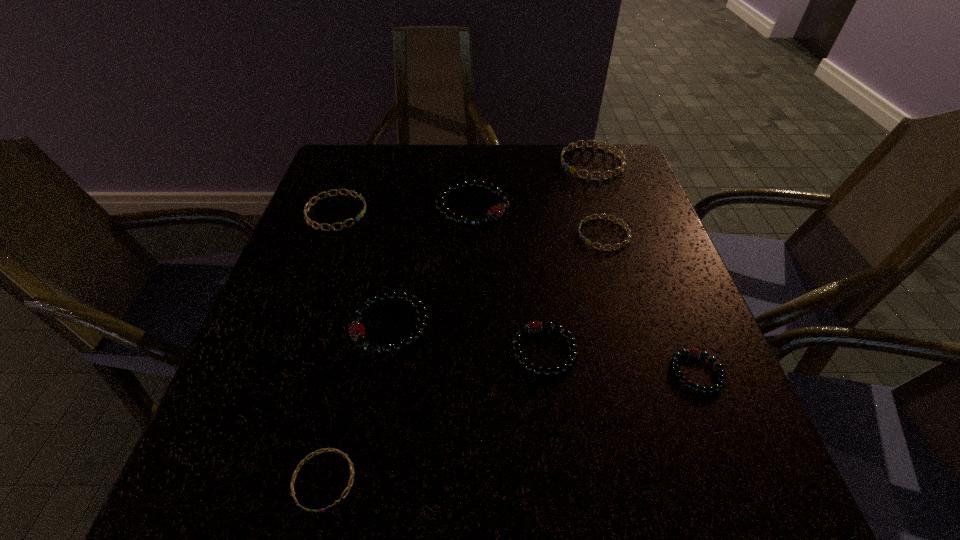
The image size is (960, 540). I want to click on the third blue bracelet from right to left, so click(298, 468).

Find the location of a particular element. the nearest bracelet is located at coordinates (298, 468).

In order to click on free region located 0.080m on the front of the tallest object in this screenshot , I will do `click(470, 254)`.

This screenshot has width=960, height=540. I want to click on free point located 0.250m on the surface of the farthest blue bracelet showing star-shaped elements, so click(x=471, y=164).

Where is `vacant point located on the surface of the farthest blue bracelet showing star-shaped elements`? This screenshot has height=540, width=960. vacant point located on the surface of the farthest blue bracelet showing star-shaped elements is located at coordinates (482, 164).

The height and width of the screenshot is (540, 960). In order to click on vacant region located 0.100m on the surface of the farthest blue bracelet showing star-shaped elements in this screenshot , I will do `click(525, 164)`.

At what (x,y) coordinates should I click in order to perform the action: click on vacant position located on the front of the second biggest black bracelet. Please return your answer as a coordinate pair (x, y). This screenshot has height=540, width=960. Looking at the image, I should click on (372, 428).

Find the location of a particular element. vacant space located on the surface of the leftmost object showing star-shaped elements is located at coordinates (395, 213).

Locate an element on the screen. The width and height of the screenshot is (960, 540). free space located 0.060m on the left of the second smallest black bracelet is located at coordinates pos(478,351).

Where is `vacant space situated on the surface of the third biggest blue bracelet showing star-shaped elements`? The height and width of the screenshot is (540, 960). vacant space situated on the surface of the third biggest blue bracelet showing star-shaped elements is located at coordinates (407, 234).